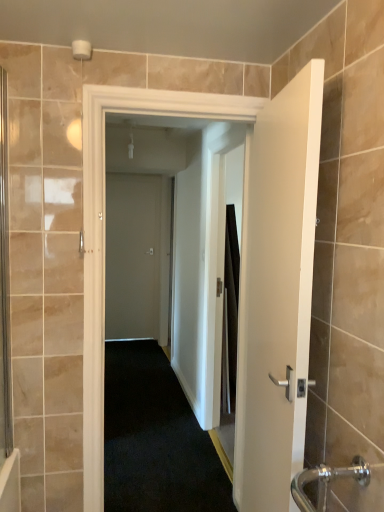
Question: Considering the relative sizes of white matte door at center, the 3th door viewed from the left, and matte gray door at center, which is the first door in back-to-front order, in the image provided, is white matte door at center, the 3th door viewed from the left, wider than matte gray door at center, which is the first door in back-to-front order,?

Choices:
 (A) yes
 (B) no

Answer: (A)

Question: From the image's perspective, is white matte door at center, the 3th door viewed from the left, below matte gray door at center, which is the 1th door in left-to-right order?

Choices:
 (A) yes
 (B) no

Answer: (A)

Question: Is white matte door at center, the 3th door viewed from the left, to the right of matte gray door at center, the 3th door positioned from the right, from the viewer's perspective?

Choices:
 (A) no
 (B) yes

Answer: (B)

Question: Is the depth of white matte door at center, the 3th door viewed from the left, greater than that of matte gray door at center, which is the first door in back-to-front order?

Choices:
 (A) no
 (B) yes

Answer: (A)

Question: Is white matte door at center, the first door from the right, turned away from matte gray door at center, the 3th door from the front?

Choices:
 (A) no
 (B) yes

Answer: (A)

Question: From the image's perspective, is white matte door at center, which is the second door from back to front, above or below matte gray door at center, which is the 1th door in left-to-right order?

Choices:
 (A) below
 (B) above

Answer: (A)

Question: Does point (200, 142) appear closer or farther from the camera than point (125, 309)?

Choices:
 (A) closer
 (B) farther

Answer: (A)

Question: Is white matte door at center, which appears as the 2th door when viewed from the front, taller or shorter than matte gray door at center, the 3th door positioned from the right?

Choices:
 (A) short
 (B) tall

Answer: (B)

Question: Looking at the image, does white matte door at center, which appears as the 2th door when viewed from the front, seem bigger or smaller compared to matte gray door at center, the 3th door positioned from the right?

Choices:
 (A) big
 (B) small

Answer: (A)

Question: Looking at the image, does matte gray door at center, the 3th door from the front, seem bigger or smaller compared to white matte door at center, which appears as the 2th door when viewed from the front?

Choices:
 (A) small
 (B) big

Answer: (A)

Question: In terms of height, does matte gray door at center, which is the first door in back-to-front order, look taller or shorter compared to white matte door at center, which is the second door from back to front?

Choices:
 (A) short
 (B) tall

Answer: (A)

Question: Is matte gray door at center, which is the 1th door in left-to-right order, to the left or to the right of white matte door at center, which is the second door from back to front, in the image?

Choices:
 (A) left
 (B) right

Answer: (A)

Question: Is matte gray door at center, which is the first door in back-to-front order, inside the boundaries of white matte door at center, which is the second door in left-to-right order, or outside?

Choices:
 (A) outside
 (B) inside

Answer: (A)

Question: Based on their positions, is white matte door at center, which is counted as the second door, starting from the right, located to the left or right of clear glass screen door at left, acting as the first screen door starting from the left?

Choices:
 (A) left
 (B) right

Answer: (B)

Question: Is white matte door at center, which is the second door in left-to-right order, taller or shorter than clear glass screen door at left, placed as the 2th screen door when sorted from right to left?

Choices:
 (A) tall
 (B) short

Answer: (A)